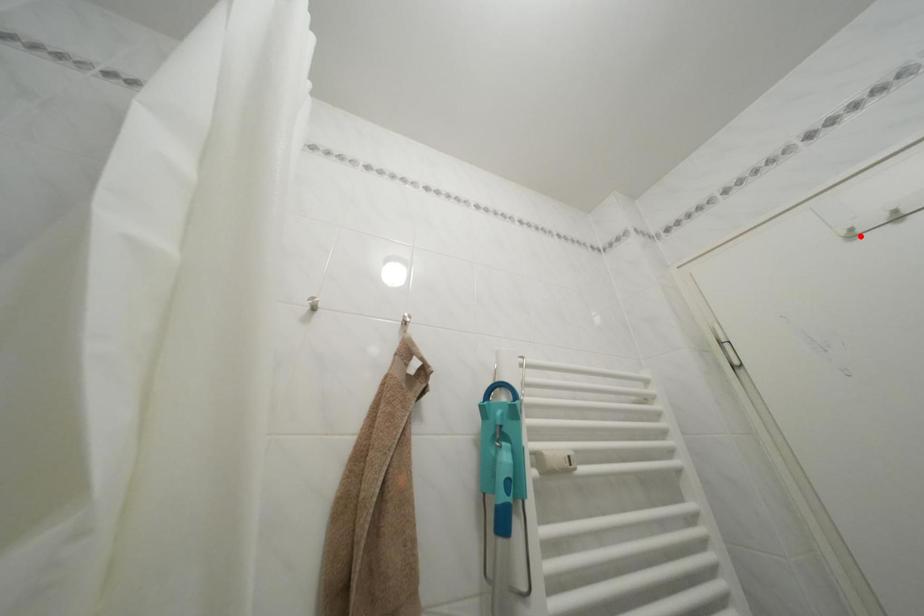
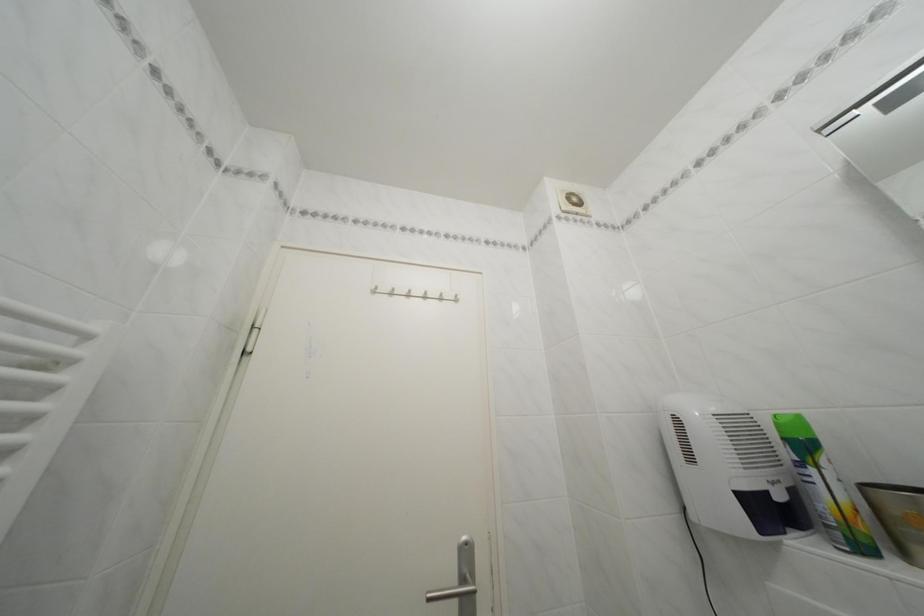
Where in the second image is the point corresponding to the highlighted location from the first image?

(385, 294)